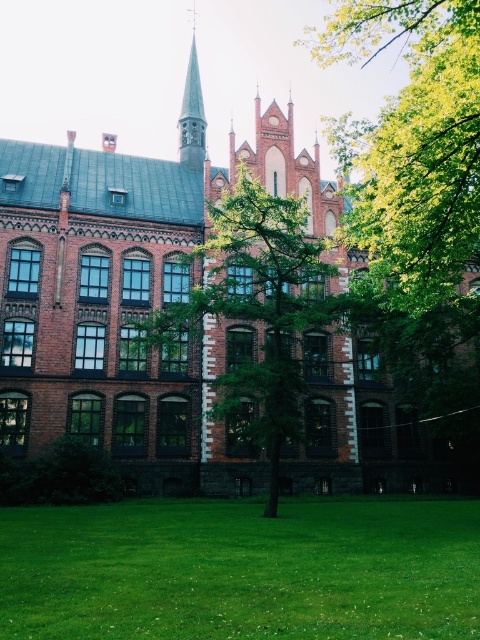
Question: Among these objects, which one is farthest from the camera?

Choices:
 (A) green grass at lower center
 (B) green leafy tree at center
 (C) green leafy tree at upper center

Answer: (B)

Question: Is green leafy tree at upper center below green leafy tree at center?

Choices:
 (A) yes
 (B) no

Answer: (B)

Question: Can you confirm if green leafy tree at center is bigger than smooth gray steeple at upper center?

Choices:
 (A) no
 (B) yes

Answer: (B)

Question: Which point appears closest to the camera in this image?

Choices:
 (A) (182, 115)
 (B) (389, 285)
 (C) (1, 515)

Answer: (C)

Question: Estimate the real-world distances between objects in this image. Which object is farther from the green leafy tree at center?

Choices:
 (A) green grass at lower center
 (B) green leafy tree at upper center
 (C) smooth gray steeple at upper center

Answer: (C)

Question: Is the position of green grass at lower center more distant than that of green leafy tree at upper center?

Choices:
 (A) no
 (B) yes

Answer: (A)